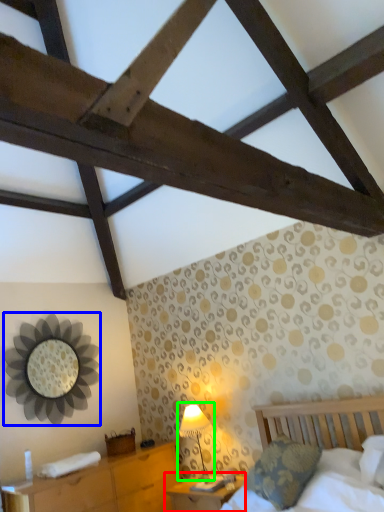
Question: Estimate the real-world distances between objects in this image. Which object is farther from nightstand (highlighted by a red box), mirror (highlighted by a blue box) or table lamp (highlighted by a green box)?

Choices:
 (A) mirror
 (B) table lamp

Answer: (A)